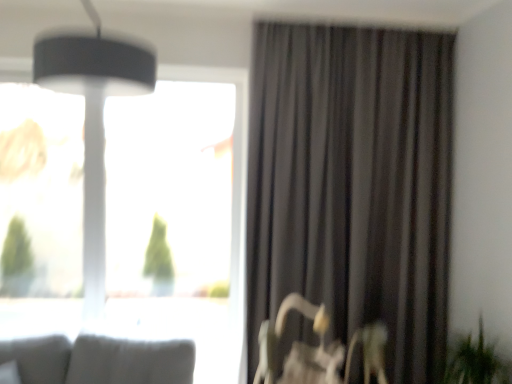
Question: Does transparent glass window at upper left have a greater height compared to green leafy plant at lower right?

Choices:
 (A) no
 (B) yes

Answer: (B)

Question: Is transparent glass window at upper left further to the viewer compared to green leafy plant at lower right?

Choices:
 (A) no
 (B) yes

Answer: (B)

Question: From a real-world perspective, is transparent glass window at upper left under green leafy plant at lower right?

Choices:
 (A) yes
 (B) no

Answer: (B)

Question: Can you confirm if transparent glass window at upper left is shorter than green leafy plant at lower right?

Choices:
 (A) no
 (B) yes

Answer: (A)

Question: From the image's perspective, is transparent glass window at upper left above green leafy plant at lower right?

Choices:
 (A) no
 (B) yes

Answer: (B)

Question: In the image, is transparent glass window at upper left positioned in front of or behind matte black lampshade at upper left?

Choices:
 (A) behind
 (B) front

Answer: (A)

Question: Looking at their shapes, would you say transparent glass window at upper left is wider or thinner than matte black lampshade at upper left?

Choices:
 (A) thin
 (B) wide

Answer: (A)

Question: From a real-world perspective, is transparent glass window at upper left positioned above or below matte black lampshade at upper left?

Choices:
 (A) below
 (B) above

Answer: (A)

Question: Do you think transparent glass window at upper left is within matte black lampshade at upper left, or outside of it?

Choices:
 (A) outside
 (B) inside

Answer: (A)

Question: In terms of height, does metallic silver swivel chair at lower right look taller or shorter compared to matte black lampshade at upper left?

Choices:
 (A) tall
 (B) short

Answer: (A)

Question: Considering the positions of metallic silver swivel chair at lower right and matte black lampshade at upper left in the image, is metallic silver swivel chair at lower right wider or thinner than matte black lampshade at upper left?

Choices:
 (A) wide
 (B) thin

Answer: (A)

Question: Considering the positions of point (323, 334) and point (45, 64), is point (323, 334) closer or farther from the camera than point (45, 64)?

Choices:
 (A) farther
 (B) closer

Answer: (A)

Question: Considering the positions of metallic silver swivel chair at lower right and matte black lampshade at upper left in the image, is metallic silver swivel chair at lower right bigger or smaller than matte black lampshade at upper left?

Choices:
 (A) big
 (B) small

Answer: (A)

Question: From the image's perspective, is green leafy plant at lower right above or below dark grey fabric curtain at right?

Choices:
 (A) below
 (B) above

Answer: (A)

Question: Based on their sizes in the image, would you say green leafy plant at lower right is bigger or smaller than dark grey fabric curtain at right?

Choices:
 (A) small
 (B) big

Answer: (A)